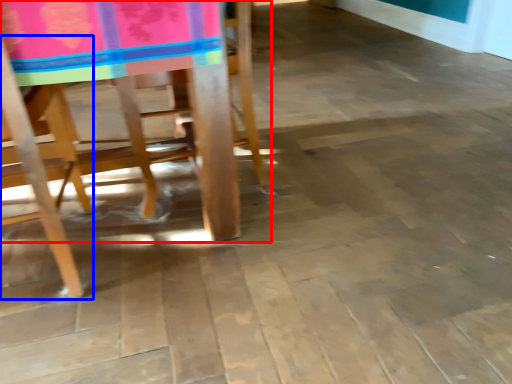
Question: Among these objects, which one is farthest to the camera, chair (highlighted by a red box) or chair (highlighted by a blue box)?

Choices:
 (A) chair
 (B) chair

Answer: (A)